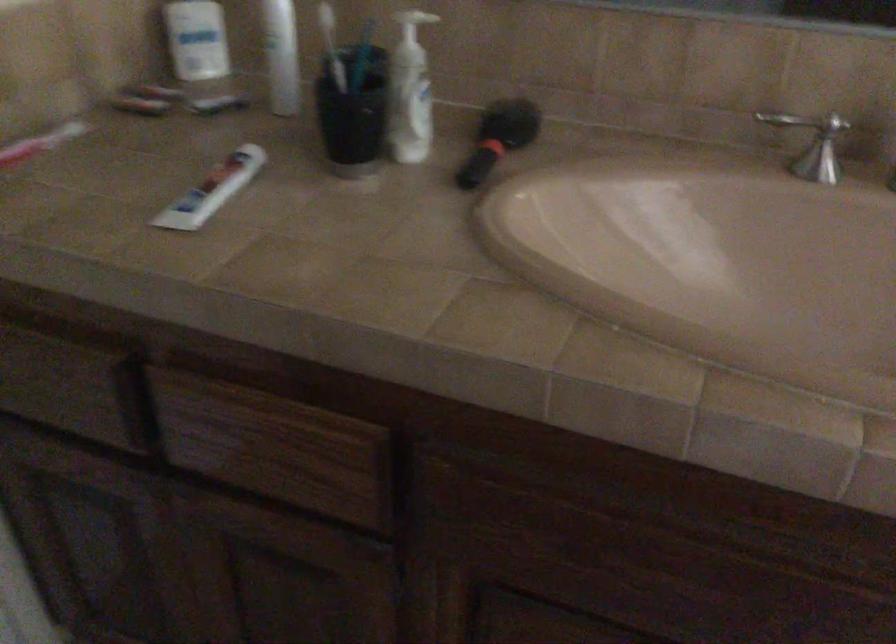
Which object does [42,145] point to?

It refers to a pink toothbrush.